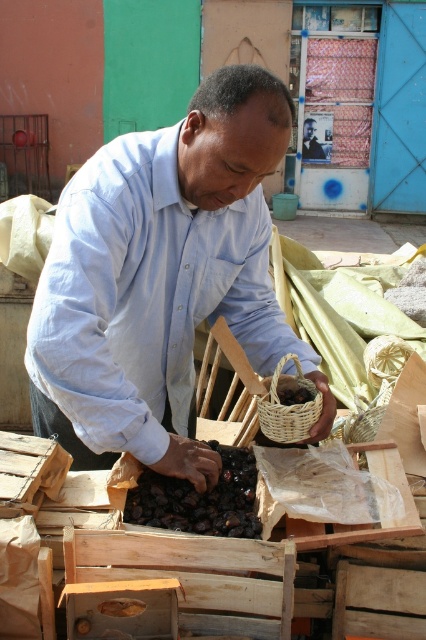
Between light blue shirt at center and matte blue shirt at center, which one has more height?

Standing taller between the two is light blue shirt at center.

Does light blue shirt at center have a greater width compared to matte blue shirt at center?

Yes.

What do you see at coordinates (163, 280) in the screenshot? I see `light blue shirt at center` at bounding box center [163, 280].

This screenshot has height=640, width=426. What are the coordinates of `light blue shirt at center` in the screenshot? It's located at (163, 280).

Is dark brown dried fruit at center taller than woven brown basket at center?

In fact, dark brown dried fruit at center may be shorter than woven brown basket at center.

Looking at this image, is dark brown dried fruit at center above woven brown basket at center?

No, dark brown dried fruit at center is not above woven brown basket at center.

Does point (141, 477) come farther from viewer compared to point (287, 419)?

Yes, point (141, 477) is behind point (287, 419).

You are a GUI agent. You are given a task and a screenshot of the screen. Output one action in this format:
    pyautogui.click(x=<x>, y=<y>)
    Task: Click on the dark brown dried fruit at center
    The width and height of the screenshot is (426, 640).
    Given the screenshot: What is the action you would take?
    pyautogui.click(x=199, y=499)

Can you confirm if dark brown dried fruit at center is taller than matte blue shirt at center?

No, dark brown dried fruit at center is not taller than matte blue shirt at center.

Is dark brown dried fruit at center bigger than matte blue shirt at center?

Actually, dark brown dried fruit at center might be smaller than matte blue shirt at center.

What do you see at coordinates (199, 499) in the screenshot? The image size is (426, 640). I see `dark brown dried fruit at center` at bounding box center [199, 499].

At what (x,y) coordinates should I click in order to perform the action: click on dark brown dried fruit at center. Please return your answer as a coordinate pair (x, y). The image size is (426, 640). Looking at the image, I should click on (199, 499).